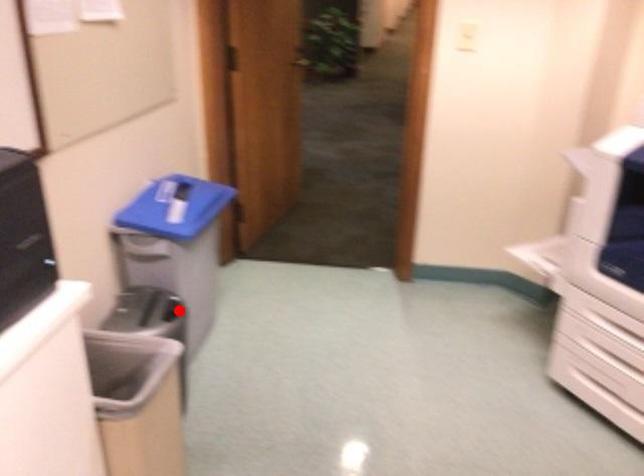
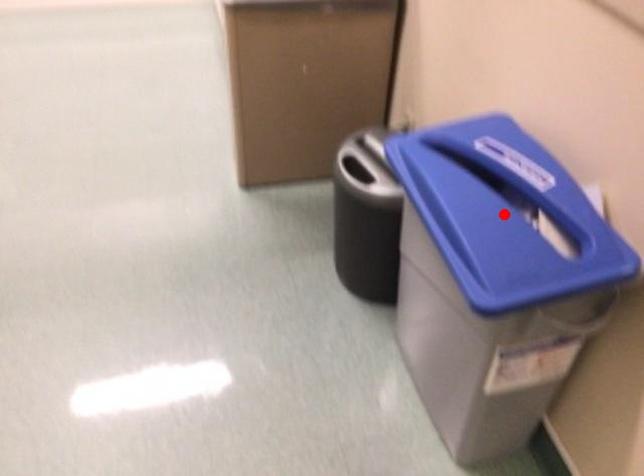
I am providing you with two images of the same scene from different viewpoints. A red point is marked on the first image and another point is marked on the second image. Are the points marked in image1 and image2 representing the same 3D position?

No